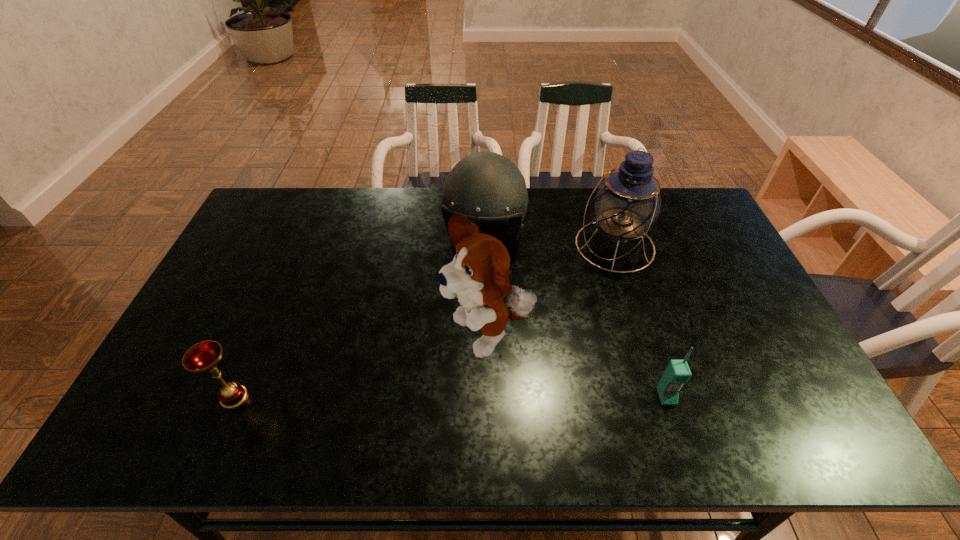
The height and width of the screenshot is (540, 960). What are the coordinates of `chalice` in the screenshot? It's located at (203, 357).

Identify the location of cellular telephone. 677,373.

I want to click on lantern, so click(x=627, y=203).

You are a GUI agent. You are given a task and a screenshot of the screen. Output one action in this format:
    pyautogui.click(x=<x>, y=<y>)
    Task: Click on the third farthest object
    This screenshot has width=960, height=540.
    Given the screenshot: What is the action you would take?
    pyautogui.click(x=478, y=276)

What are the coordinates of `the third shortest object` in the screenshot? It's located at (485, 186).

Where is `free space located 0.100m on the back of the leftmost object`? free space located 0.100m on the back of the leftmost object is located at coordinates (254, 350).

Where is `vacant region located on the front-facing side of the lantern`? vacant region located on the front-facing side of the lantern is located at coordinates (552, 295).

Where is `vacant space situated on the front-facing side of the lantern`? vacant space situated on the front-facing side of the lantern is located at coordinates (559, 291).

Where is `blank area located on the front-facing side of the lantern`? The width and height of the screenshot is (960, 540). blank area located on the front-facing side of the lantern is located at coordinates (543, 302).

This screenshot has height=540, width=960. I want to click on vacant region located on the face of the third nearest object, so click(421, 387).